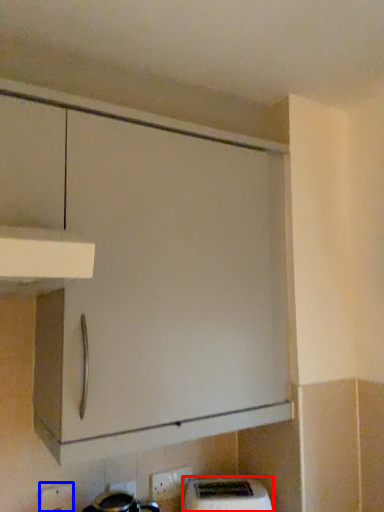
Question: Which object appears closest to the camera in this image, home appliance (highlighted by a red box) or electric outlet (highlighted by a blue box)?

Choices:
 (A) home appliance
 (B) electric outlet

Answer: (B)